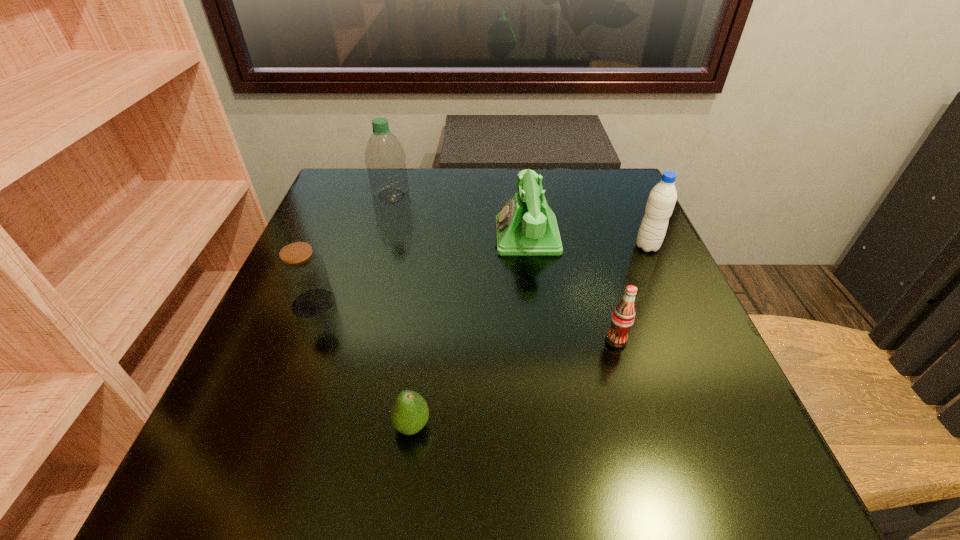
The width and height of the screenshot is (960, 540). Find the location of `object that is the third closest to the jar`. object that is the third closest to the jar is located at coordinates (526, 225).

You are a GUI agent. You are given a task and a screenshot of the screen. Output one action in this format:
    pyautogui.click(x=<x>, y=<y>)
    Task: Click on the vacant space that satisfies the following two spatial constraints: 1. on the dial of the telephone; 2. on the front side of the nearest object
    This screenshot has height=540, width=960.
    Given the screenshot: What is the action you would take?
    pyautogui.click(x=552, y=426)